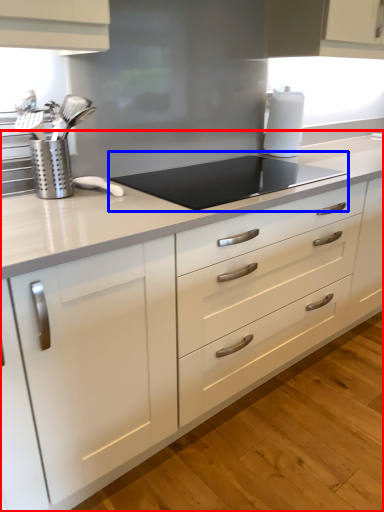
Question: Among these objects, which one is farthest to the camera, countertop (highlighted by a red box) or gas stove (highlighted by a blue box)?

Choices:
 (A) countertop
 (B) gas stove

Answer: (B)